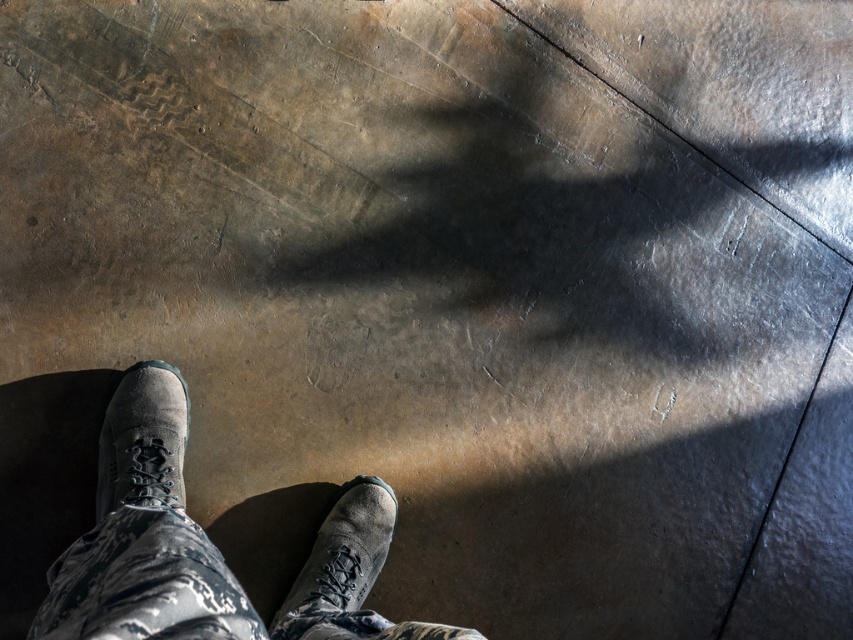
Between camouflage pants at center and gray suede boot at lower left, which one is positioned higher?

gray suede boot at lower left is above.

Which of these two, camouflage pants at center or gray suede boot at lower left, stands taller?

camouflage pants at center

Which is behind, point (160, 433) or point (171, 460)?

The point (160, 433) is behind.

I want to click on camouflage pants at center, so click(204, 547).

Can you confirm if gray suede boot at lower left is positioned to the left of suede/black shoe at center?

Yes, gray suede boot at lower left is to the left of suede/black shoe at center.

Who is taller, gray suede boot at lower left or suede/black shoe at center?

Standing taller between the two is gray suede boot at lower left.

Who is more distant from viewer, (125, 444) or (299, 589)?

Point (299, 589)

The image size is (853, 640). What are the coordinates of `gray suede boot at lower left` in the screenshot? It's located at (143, 440).

Which is below, camouflage pants at center or suede/black shoe at center?

suede/black shoe at center is lower down.

Based on the photo, can you confirm if camouflage pants at center is taller than suede/black shoe at center?

Yes, camouflage pants at center is taller than suede/black shoe at center.

Describe the element at coordinates (204, 547) in the screenshot. I see `camouflage pants at center` at that location.

Where is `camouflage pants at center`? camouflage pants at center is located at coordinates pos(204,547).